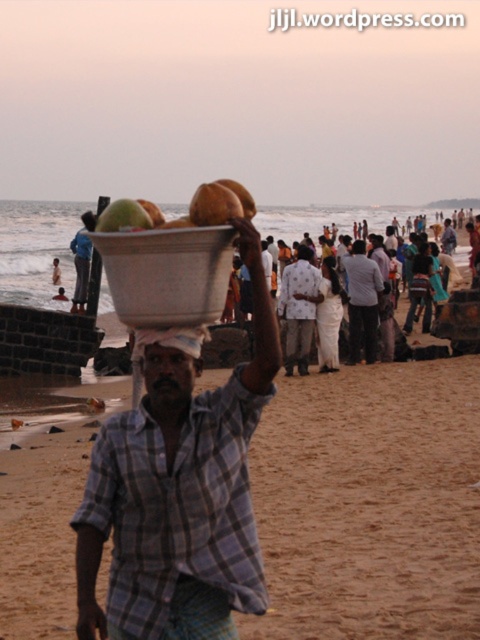
Question: Considering the relative positions of white matte bowl at center and white cloth at center in the image provided, where is white matte bowl at center located with respect to white cloth at center?

Choices:
 (A) right
 (B) left

Answer: (A)

Question: Which of the following is the farthest from the observer?

Choices:
 (A) printed cotton shirt at center
 (B) plaid cotton shirt at center

Answer: (A)

Question: Does plaid cotton shirt at center appear over green matte coconut at center?

Choices:
 (A) no
 (B) yes

Answer: (A)

Question: Does green matte coconut at center appear over matte brown bowl at center?

Choices:
 (A) no
 (B) yes

Answer: (A)

Question: Which point is farther to the camera?

Choices:
 (A) brown sandy beach at lower center
 (B) matte white head at center
 (C) printed cotton shirt at center

Answer: (B)

Question: Which point appears closest to the camera in this image?

Choices:
 (A) (241, 216)
 (B) (224, 211)
 (C) (400, 224)
 (D) (311, 253)

Answer: (B)